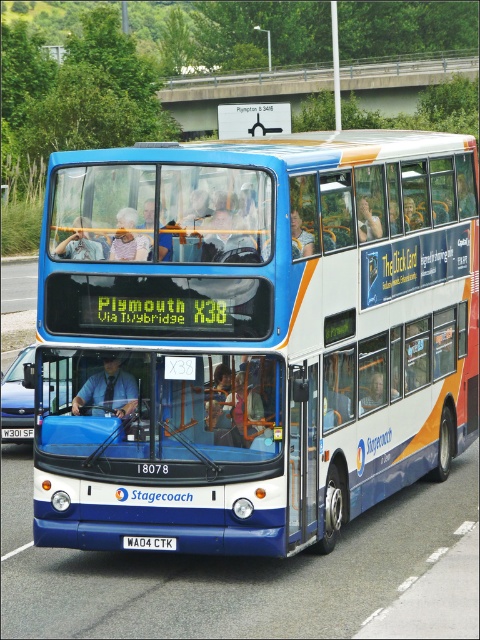
Consider the image. You are standing at the center of the image. Which direction should you walk to reach the asphalt road at left?

You should walk to the left to reach the asphalt road at left because it is located at the left side of the image.

You are a driver who needs to park your car on the asphalt road at left. The white plastic license plate at center is blocking the parking spot. Can you drive around it without leaving the road?

The asphalt road at left might be wider than the white plastic license plate at center, so you can drive around it without leaving the road.